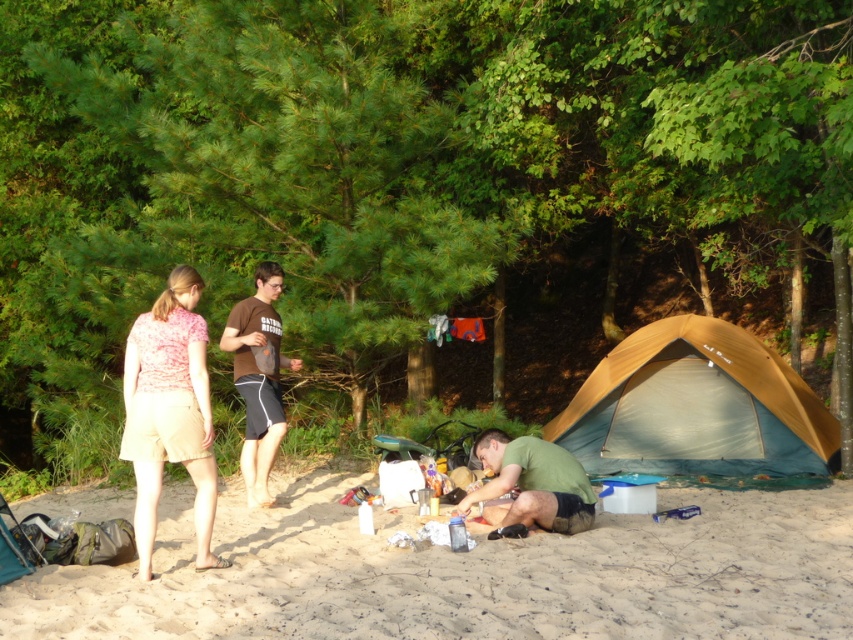
You are standing at the point labeled as point (695,406) in the image. What object is directly behind you?

The point (695,406) marks the tan fabric tent at lower right, so the object directly behind you is the tan fabric tent at lower right.

You are planning to set up a new tent in the camping area. The current tan fabric tent at lower right is at coordinates point 0.636, 0.817. If you want to place your tent 1.5 meters north of the existing one, what would be the new coordinates?

The new coordinates would be calculated by adding 1.5 meters north to the existing coordinates of the tan fabric tent at lower right. However, without knowing the scale of the coordinate system, we cannot provide exact numerical coordinates. Please consult the map scale for accurate placement.